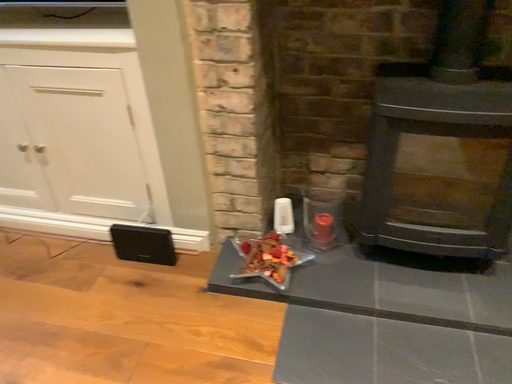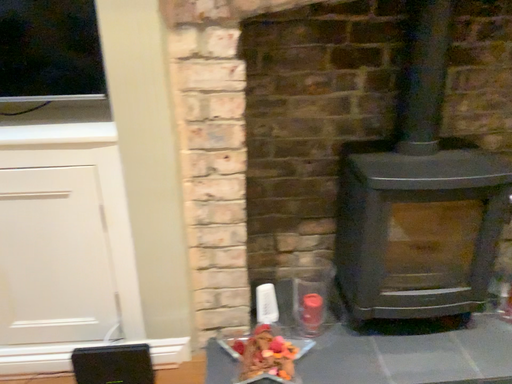
Question: How did the camera likely rotate when shooting the video?

Choices:
 (A) rotated left
 (B) rotated right

Answer: (B)